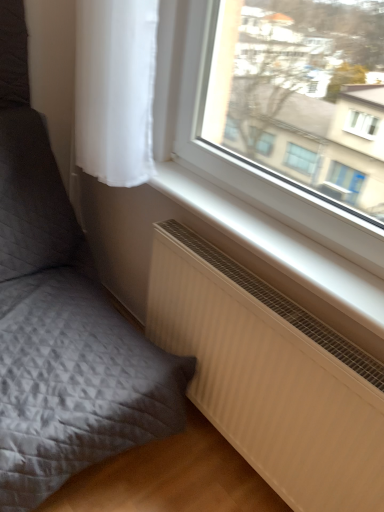
Identify the location of free point above white matte window sill at lower center (from a real-world perspective). (268, 228).